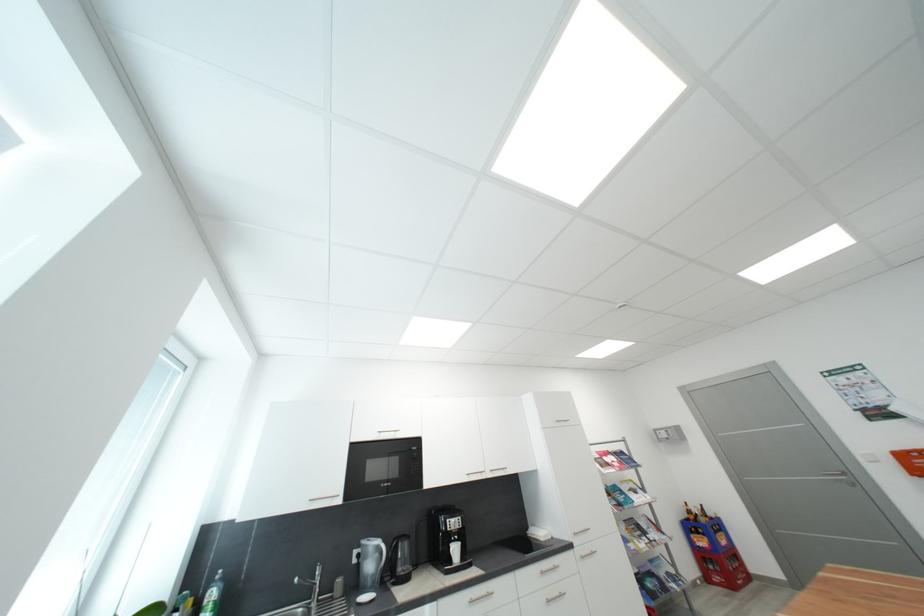
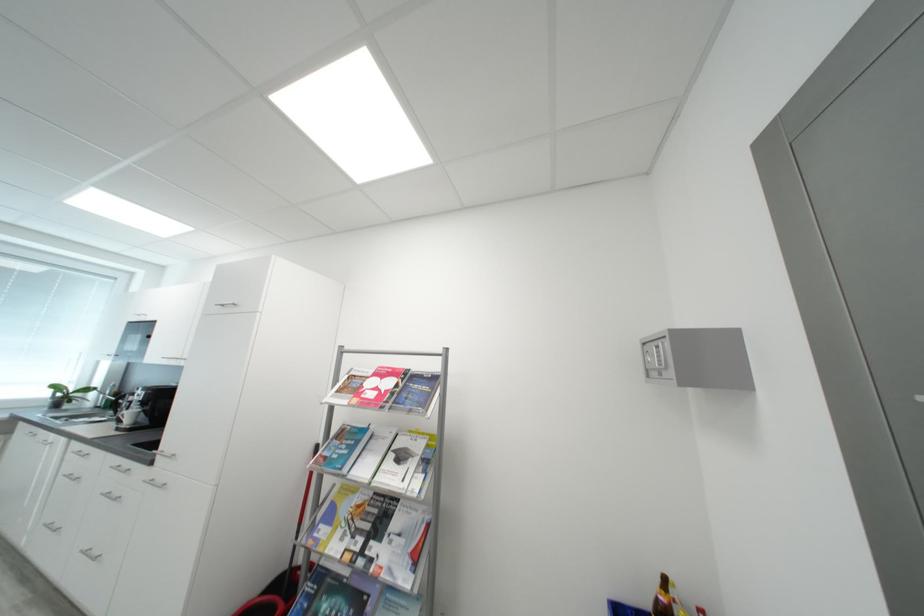
The point at (658,539) is marked in the first image. Where is the corresponding point in the second image?

(380, 549)